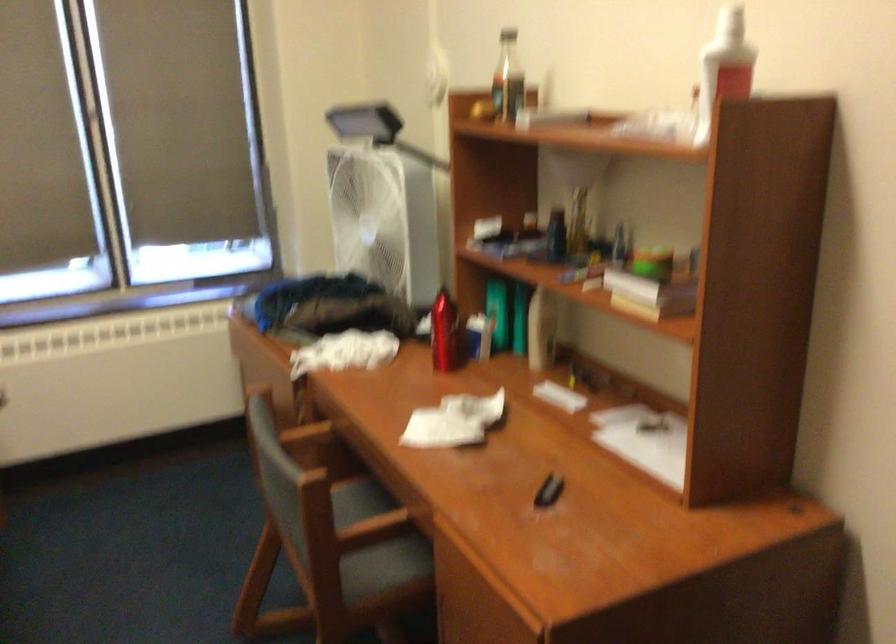
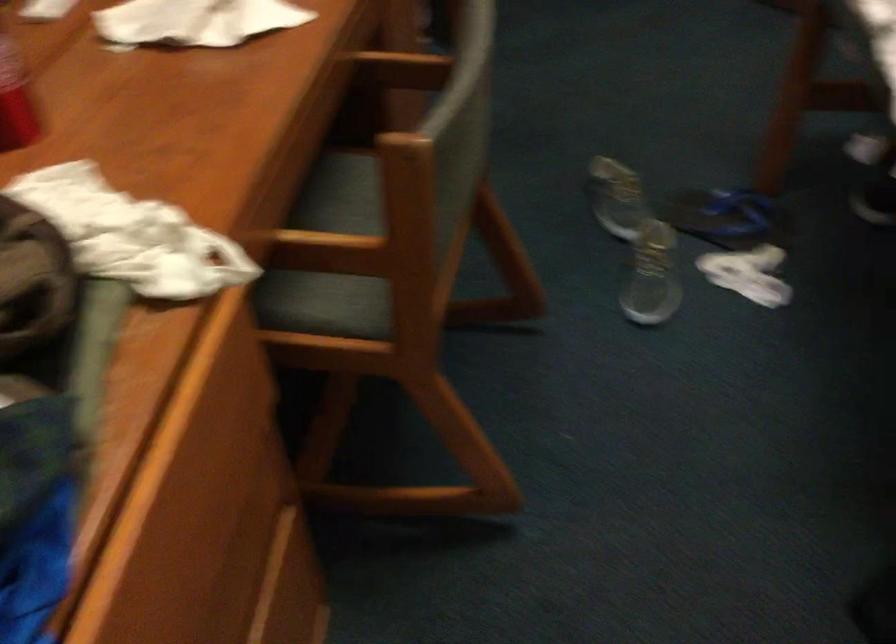
Find the pixel in the second image that matches the point at 302,437 in the first image.

(339, 250)